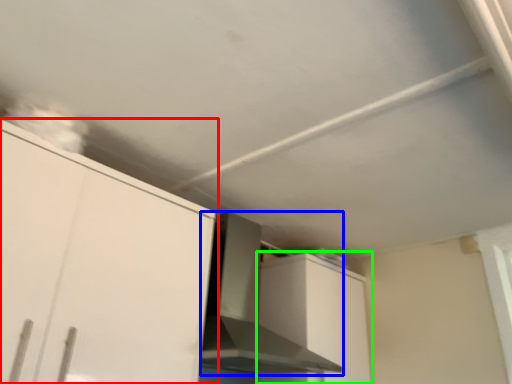
Question: Considering the real-world distances, which object is closest to cabinetry (highlighted by a red box)? vent (highlighted by a blue box) or cabinetry (highlighted by a green box).

Choices:
 (A) vent
 (B) cabinetry

Answer: (A)